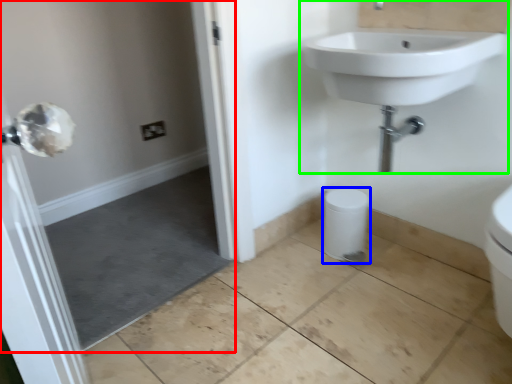
Question: Considering the real-world distances, which object is farthest from screen door (highlighted by a red box)? bidet (highlighted by a blue box) or sink (highlighted by a green box)?

Choices:
 (A) bidet
 (B) sink

Answer: (B)